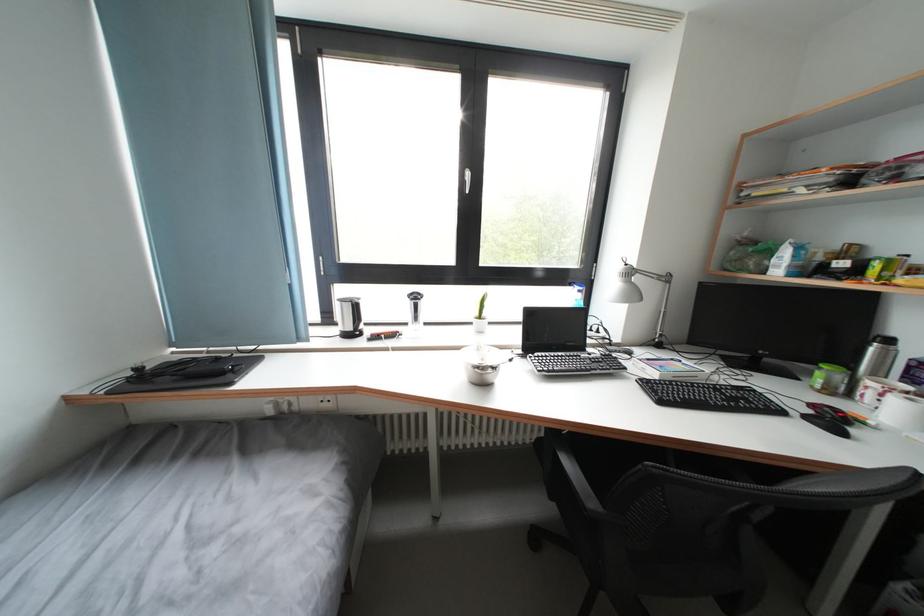
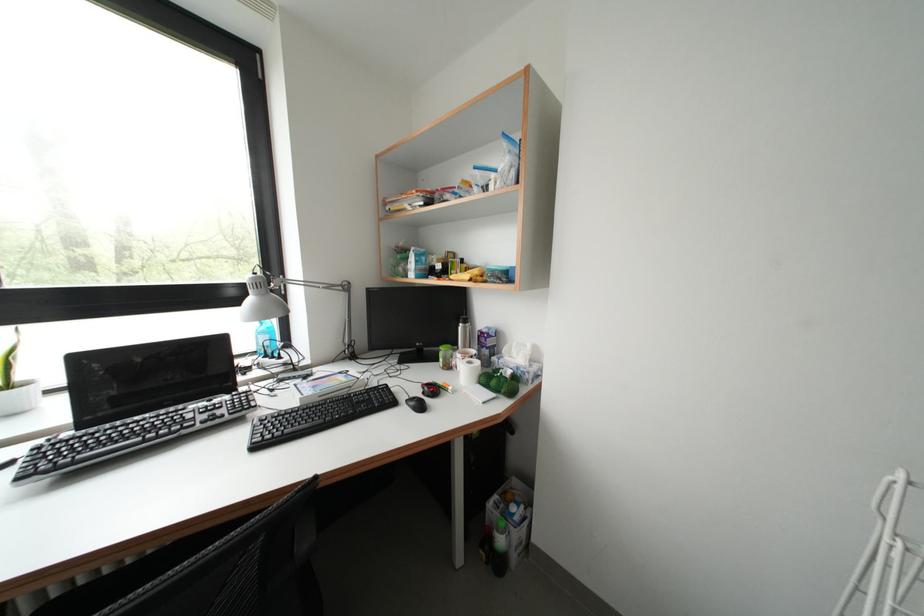
Find the pixel in the second image that matches [633,270] in the first image.

(261, 278)